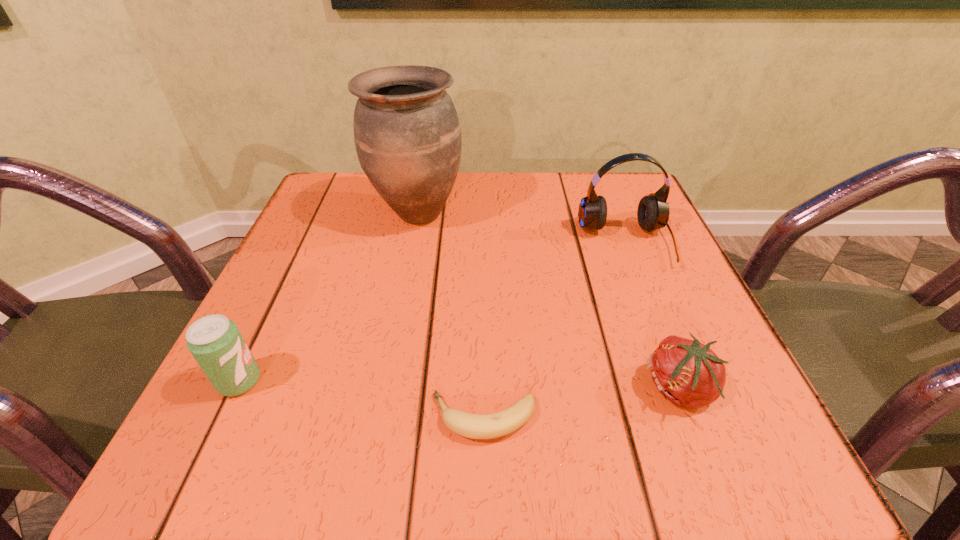
Identify the location of tomato located in the right edge section of the desktop. (688, 373).

I want to click on object located in the far left corner section of the desktop, so click(407, 135).

Where is `object that is positioned at the far right corner`? The image size is (960, 540). object that is positioned at the far right corner is located at coordinates (653, 211).

Identify the location of object that is positioned at the near right corner. This screenshot has height=540, width=960. (688, 373).

Where is `blank space at the far edge of the desktop`? blank space at the far edge of the desktop is located at coordinates (385, 222).

Locate an element on the screen. Image resolution: width=960 pixels, height=540 pixels. vacant space at the near edge of the desktop is located at coordinates coord(537,465).

In order to click on vacant space at the left edge of the desktop in this screenshot , I will do `click(331, 301)`.

The width and height of the screenshot is (960, 540). In the image, there is a desktop. Find the location of `free space at the right edge`. free space at the right edge is located at coordinates (592, 249).

The width and height of the screenshot is (960, 540). Identify the location of free point at the far right corner. (595, 188).

Find the location of `free space at the near right corner`. free space at the near right corner is located at coordinates (763, 473).